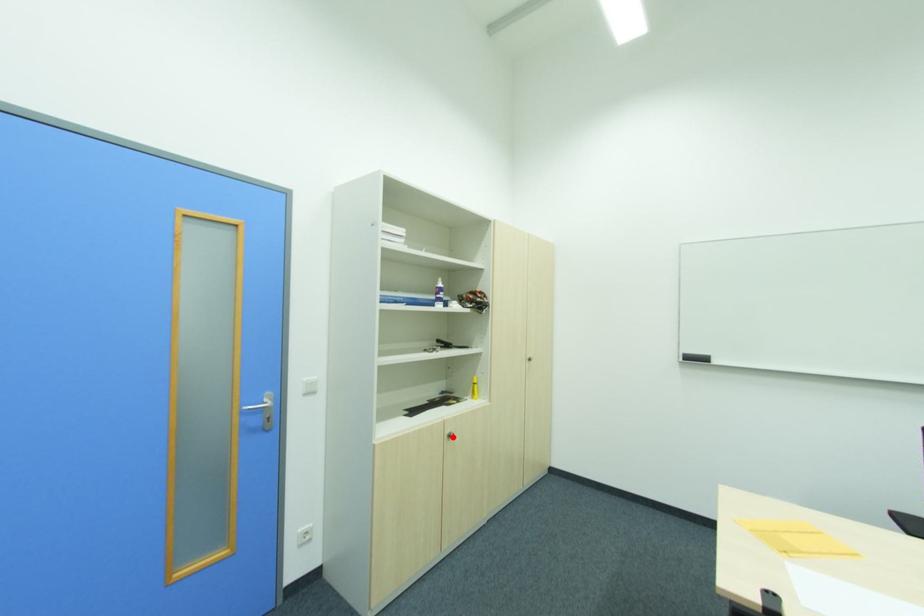
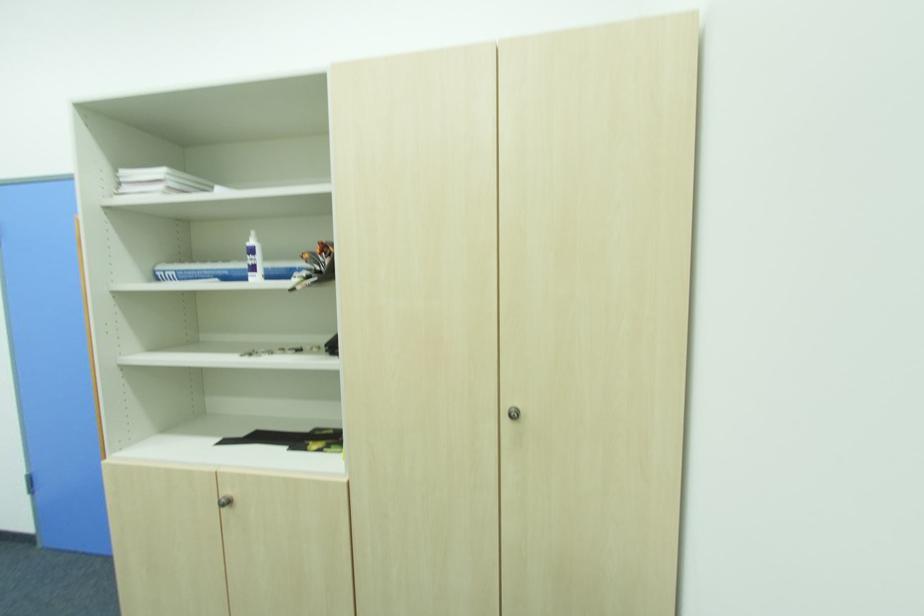
Question: I am providing you with two images of the same scene from different viewpoints. In image1, a red point is highlighted. Considering the same 3D point in image2, which of the following is correct?

Choices:
 (A) It is closer
 (B) It is farther

Answer: (A)